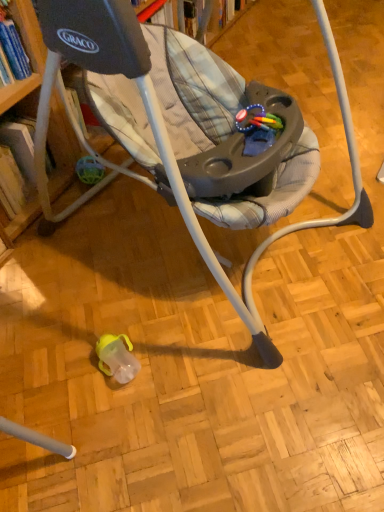
Question: From the image's perspective, is rubberized plastic teething ring at center below hardcover book at left?

Choices:
 (A) yes
 (B) no

Answer: (B)

Question: Considering the relative positions of rubberized plastic teething ring at center and hardcover book at left in the image provided, is rubberized plastic teething ring at center in front of hardcover book at left?

Choices:
 (A) no
 (B) yes

Answer: (B)

Question: From the image's perspective, would you say rubberized plastic teething ring at center is positioned over hardcover book at left?

Choices:
 (A) yes
 (B) no

Answer: (A)

Question: Is rubberized plastic teething ring at center smaller than hardcover book at left?

Choices:
 (A) yes
 (B) no

Answer: (A)

Question: Is rubberized plastic teething ring at center wider than hardcover book at left?

Choices:
 (A) yes
 (B) no

Answer: (B)

Question: Does rubberized plastic teething ring at center lie behind hardcover book at left?

Choices:
 (A) no
 (B) yes

Answer: (A)

Question: Is hardcover book at left further to camera compared to rubberized plastic teething ring at center?

Choices:
 (A) no
 (B) yes

Answer: (B)

Question: Is hardcover book at left positioned far away from rubberized plastic teething ring at center?

Choices:
 (A) yes
 (B) no

Answer: (B)

Question: Does hardcover book at left contain rubberized plastic teething ring at center?

Choices:
 (A) yes
 (B) no

Answer: (B)

Question: Does hardcover book at left turn towards rubberized plastic teething ring at center?

Choices:
 (A) no
 (B) yes

Answer: (B)

Question: Are hardcover book at left and rubberized plastic teething ring at center beside each other?

Choices:
 (A) no
 (B) yes

Answer: (A)

Question: Considering the relative sizes of hardcover book at left and rubberized plastic teething ring at center in the image provided, is hardcover book at left bigger than rubberized plastic teething ring at center?

Choices:
 (A) no
 (B) yes

Answer: (B)

Question: Considering the relative sizes of matte gray baby swing at center and hardcover book at left in the image provided, is matte gray baby swing at center thinner than hardcover book at left?

Choices:
 (A) no
 (B) yes

Answer: (A)